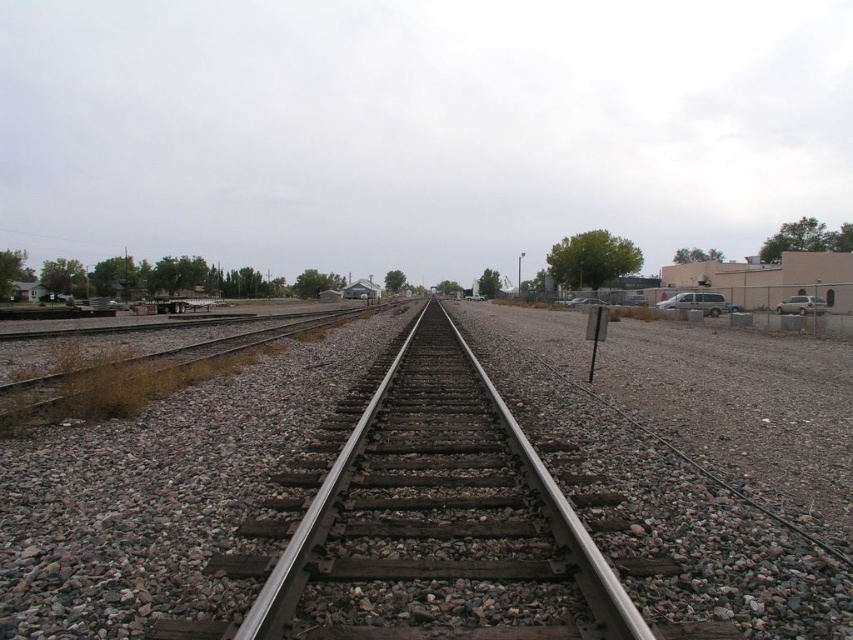
Question: Is gray gravel at center to the right of metal/smooth train track at center from the viewer's perspective?

Choices:
 (A) no
 (B) yes

Answer: (B)

Question: Does gray gravel at center appear under metal/smooth train track at center?

Choices:
 (A) yes
 (B) no

Answer: (A)

Question: Among these objects, which one is farthest from the camera?

Choices:
 (A) metal/smooth train track at center
 (B) gray gravel at center

Answer: (B)

Question: Can you confirm if gray gravel at center is positioned to the right of metal/smooth train track at center?

Choices:
 (A) yes
 (B) no

Answer: (A)